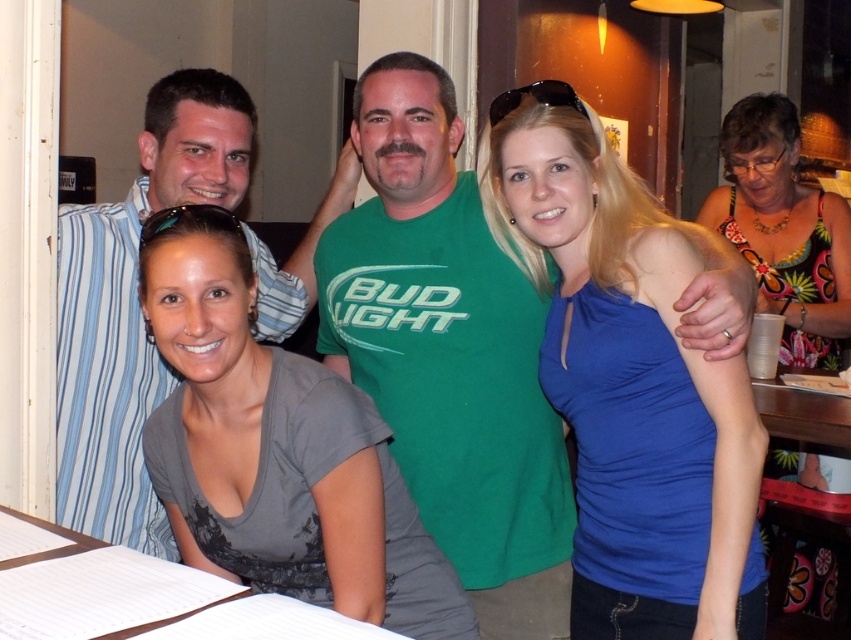
Question: Among these points, which one is farthest from the camera?

Choices:
 (A) (172, 321)
 (B) (743, 426)

Answer: (B)

Question: Does blue fabric shirt at center appear on the left side of white paper at lower left?

Choices:
 (A) yes
 (B) no

Answer: (B)

Question: Which point is farther to the camera?

Choices:
 (A) floral tank top at upper right
 (B) white paper at lower left

Answer: (A)

Question: Considering the real-world distances, which object is farthest from the white paper at lower left?

Choices:
 (A) gray fabric shirt at lower left
 (B) matte blue shirt at center

Answer: (B)

Question: Is gray fabric shirt at lower left to the right of floral tank top at upper right from the viewer's perspective?

Choices:
 (A) no
 (B) yes

Answer: (A)

Question: Does blue fabric shirt at center come behind gray fabric shirt at lower left?

Choices:
 (A) yes
 (B) no

Answer: (A)